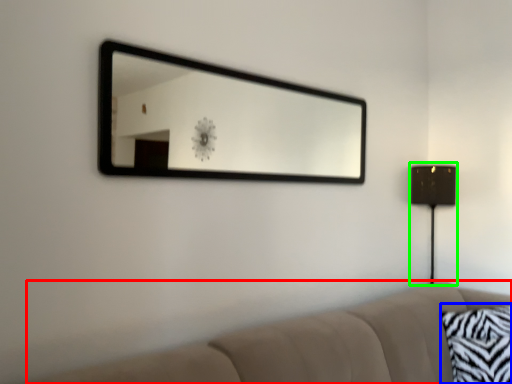
Question: Based on their relative distances, which object is nearer to studio couch (highlighted by a red box)? Choose from pillow (highlighted by a blue box) and table lamp (highlighted by a green box).

Choices:
 (A) pillow
 (B) table lamp

Answer: (A)